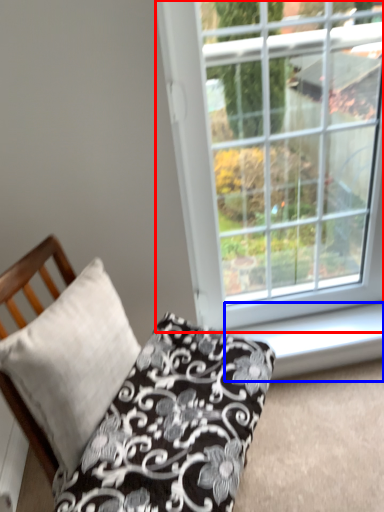
Question: Which point is closer to the camera, window (highlighted by a red box) or window sill (highlighted by a blue box)?

Choices:
 (A) window
 (B) window sill

Answer: (A)